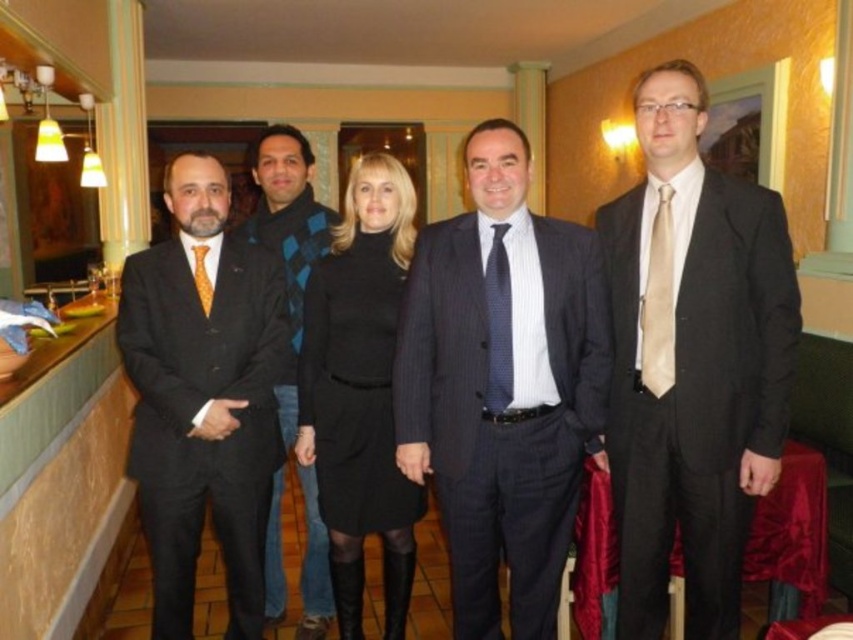
You are standing in a banquet hall and see the dark gray pinstripe suit at center. If you want to shake hands with the person wearing it, will you need to move closer? Explain your reasoning.

The dark gray pinstripe suit at center and the viewer are 6.75 feet apart. Since a typical handshake requires being within about 3 feet, you would need to move closer to reach the person.